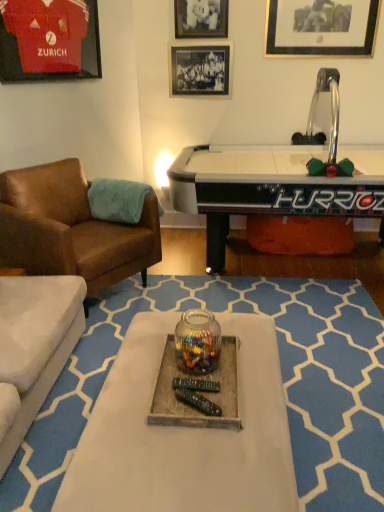
Question: Can you confirm if translucent glass jar at center is thinner than brown leather chair at left?

Choices:
 (A) yes
 (B) no

Answer: (A)

Question: Is translucent glass jar at center further to the viewer compared to brown leather chair at left?

Choices:
 (A) yes
 (B) no

Answer: (B)

Question: Is translucent glass jar at center surrounding brown leather chair at left?

Choices:
 (A) no
 (B) yes

Answer: (A)

Question: From a real-world perspective, is translucent glass jar at center positioned under brown leather chair at left based on gravity?

Choices:
 (A) yes
 (B) no

Answer: (B)

Question: Considering the relative positions of translucent glass jar at center and brown leather chair at left in the image provided, is translucent glass jar at center to the right of brown leather chair at left from the viewer's perspective?

Choices:
 (A) no
 (B) yes

Answer: (B)

Question: Looking at their shapes, would you say black matte picture frame at upper center, which appears as the 4th picture frame when viewed from the left, is wider or thinner than metallic silver picture frame at upper center, acting as the second picture frame starting from the right?

Choices:
 (A) thin
 (B) wide

Answer: (A)

Question: From their relative heights in the image, would you say black matte picture frame at upper center, which appears as the 4th picture frame when viewed from the left, is taller or shorter than metallic silver picture frame at upper center, positioned as the third picture frame in left-to-right order?

Choices:
 (A) tall
 (B) short

Answer: (A)

Question: From the image's perspective, is black matte picture frame at upper center, the first picture frame when ordered from right to left, above or below metallic silver picture frame at upper center, positioned as the third picture frame in left-to-right order?

Choices:
 (A) above
 (B) below

Answer: (B)

Question: Is black matte picture frame at upper center, the first picture frame when ordered from right to left, inside or outside of metallic silver picture frame at upper center, acting as the second picture frame starting from the right?

Choices:
 (A) outside
 (B) inside

Answer: (A)

Question: From the image's perspective, is matte jersey at upper left, placed as the first picture frame when sorted from left to right, positioned above or below black matte picture frame at upper center, positioned as the 2th picture frame in left-to-right order?

Choices:
 (A) below
 (B) above

Answer: (A)

Question: Is matte jersey at upper left, placed as the first picture frame when sorted from left to right, bigger or smaller than black matte picture frame at upper center, positioned as the 2th picture frame in left-to-right order?

Choices:
 (A) small
 (B) big

Answer: (B)

Question: Based on their positions, is matte jersey at upper left, which appears as the fourth picture frame when viewed from the right, located to the left or right of black matte picture frame at upper center, positioned as the 2th picture frame in left-to-right order?

Choices:
 (A) left
 (B) right

Answer: (A)

Question: Would you say matte jersey at upper left, placed as the first picture frame when sorted from left to right, is inside or outside black matte picture frame at upper center, positioned as the 2th picture frame in left-to-right order?

Choices:
 (A) inside
 (B) outside

Answer: (B)

Question: In terms of width, does black matte picture frame at upper center, positioned as the 2th picture frame in left-to-right order, look wider or thinner when compared to matte jersey at upper left, placed as the first picture frame when sorted from left to right?

Choices:
 (A) thin
 (B) wide

Answer: (A)

Question: Relative to matte jersey at upper left, which appears as the fourth picture frame when viewed from the right, is black matte picture frame at upper center, positioned as the 3th picture frame in right-to-left order, in front or behind?

Choices:
 (A) front
 (B) behind

Answer: (B)